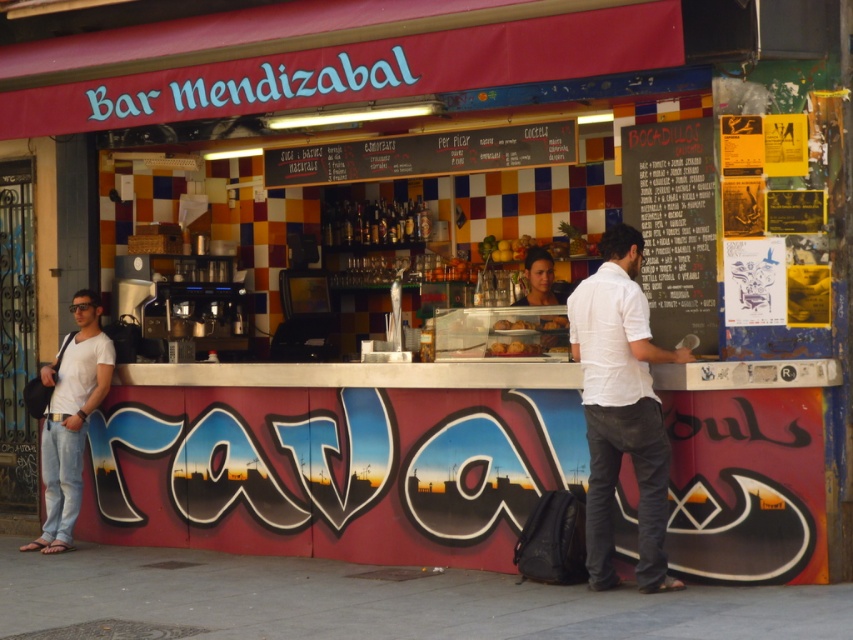
Does point (648, 464) lie in front of point (706, 284)?

That is True.

The height and width of the screenshot is (640, 853). What do you see at coordinates (621, 408) in the screenshot? I see `white cotton shirt at center` at bounding box center [621, 408].

Locate an element on the screen. The image size is (853, 640). white cotton shirt at center is located at coordinates tap(621, 408).

Does black chalkboard menu at center appear on the right side of golden brown pastry at center?

Indeed, black chalkboard menu at center is positioned on the right side of golden brown pastry at center.

Who is more distant from viewer, (691, 307) or (503, 353)?

The point (503, 353) is behind.

Find the location of `black chalkboard menu at center`. black chalkboard menu at center is located at coordinates (672, 225).

You are a GUI agent. You are given a task and a screenshot of the screen. Output one action in this format:
    pyautogui.click(x=<x>, y=<y>)
    Task: Click on the black chalkboard menu at center
    Image resolution: width=853 pixels, height=640 pixels.
    Given the screenshot: What is the action you would take?
    pyautogui.click(x=672, y=225)

Where is `black chalkboard menu at center`? Image resolution: width=853 pixels, height=640 pixels. black chalkboard menu at center is located at coordinates (672, 225).

Can you confirm if black chalkboard menu at center is bigger than matte black face at center?

Yes, black chalkboard menu at center is bigger than matte black face at center.

The height and width of the screenshot is (640, 853). Describe the element at coordinates (672, 225) in the screenshot. I see `black chalkboard menu at center` at that location.

Image resolution: width=853 pixels, height=640 pixels. I want to click on black chalkboard menu at center, so click(672, 225).